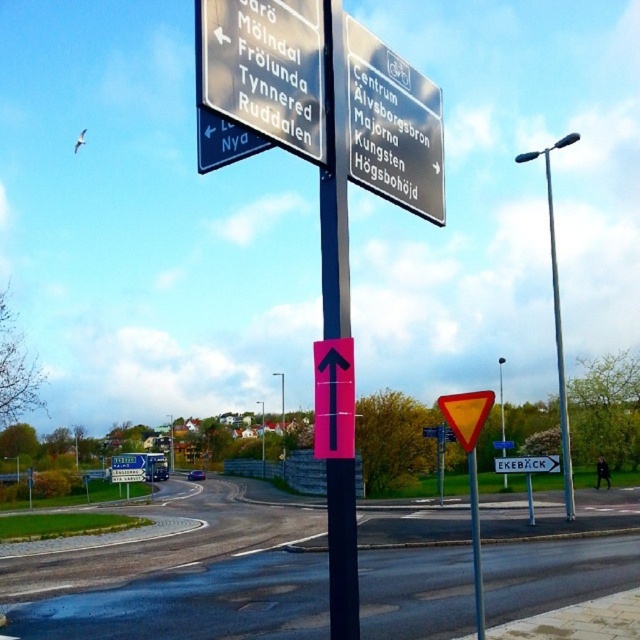
You are a delivery driver who needs to attach a new sign to the pole. The new sign is the same size as the metallic silver sign at upper center. Can you attach it to the black plastic pole at center without overlapping any existing signs?

The metallic silver sign at upper center occupies less space than the black plastic pole at center, so yes, you can attach the new sign of the same size to the black plastic pole at center without overlapping existing signs since there is enough space available.

You are standing at the intersection and need to reach the nearest sign. Which direction should you walk to reach the metallic silver sign at upper center before the black plastic pole at center?

The metallic silver sign at upper center is to the left of the black plastic pole at center, so you should walk towards the left side to reach it before the black plastic pole at center.

You are standing at the traffic signpost and want to take a photo of both point (413, 113) and point (337, 497) in the scene. Which point should you focus on first to ensure both are in clear view?

You should focus on point (413, 113) first because it is closer to the camera than point (337, 497). By focusing on the closer point, the farther point will also be in focus due to the depth of field.